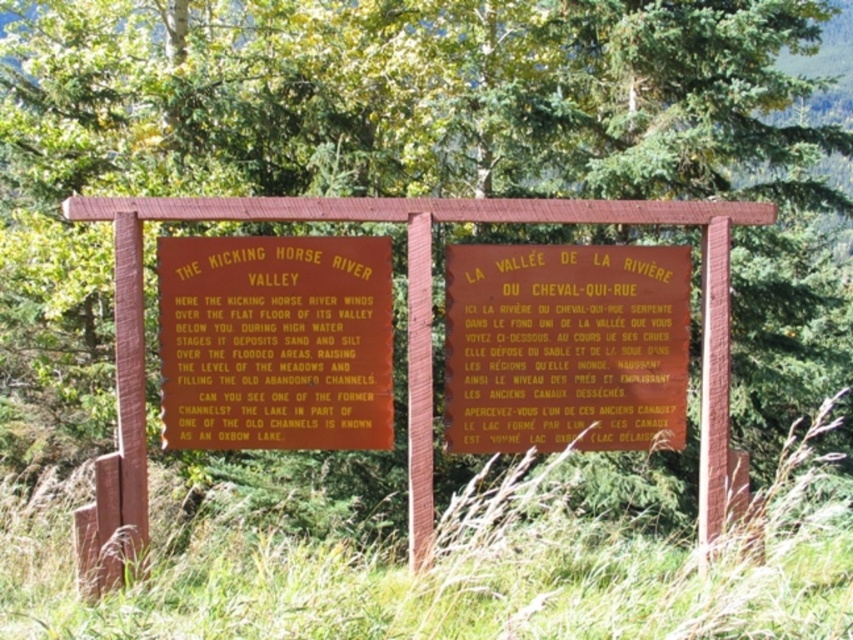
Is yellow paper sign at center smaller than matte orange sign at center?

Incorrect, yellow paper sign at center is not smaller in size than matte orange sign at center.

What do you see at coordinates (566, 346) in the screenshot? The height and width of the screenshot is (640, 853). I see `yellow paper sign at center` at bounding box center [566, 346].

Locate an element on the screen. yellow paper sign at center is located at coordinates (566, 346).

Between green grass at lower center and matte orange sign at center, which one appears on the right side from the viewer's perspective?

Positioned to the right is green grass at lower center.

Is point (173, 634) farther from viewer compared to point (160, 400)?

No, it is in front of (160, 400).

Describe the element at coordinates (462, 572) in the screenshot. I see `green grass at lower center` at that location.

Find the location of a particular element. green grass at lower center is located at coordinates (462, 572).

Can you confirm if green grass at lower center is smaller than yellow paper sign at center?

Actually, green grass at lower center might be larger than yellow paper sign at center.

Based on the photo, who is shorter, green grass at lower center or yellow paper sign at center?

Standing shorter between the two is green grass at lower center.

Identify the location of green grass at lower center. pos(462,572).